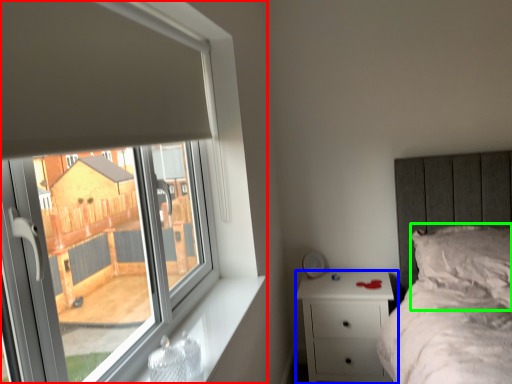
Question: Based on their relative distances, which object is nearer to window (highlighted by a red box)? Choose from nightstand (highlighted by a blue box) and pillow (highlighted by a green box).

Choices:
 (A) nightstand
 (B) pillow

Answer: (A)